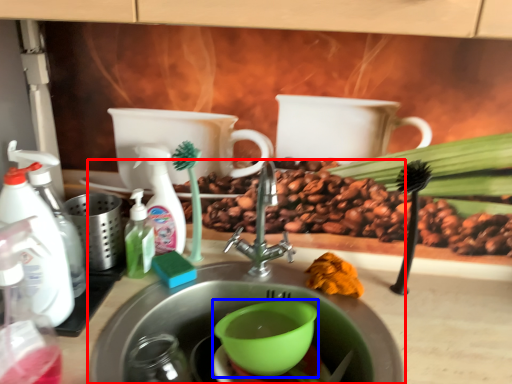
Question: Which of the following is the closest to the observer, sink (highlighted by a red box) or mixing bowl (highlighted by a blue box)?

Choices:
 (A) sink
 (B) mixing bowl

Answer: (A)